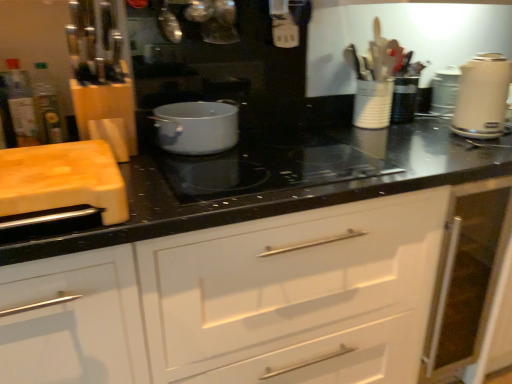
Locate an element on the screen. The image size is (512, 384). vacant space underneath white glossy electric kettle at right, the 1th kitchen appliance positioned from the right (from a real-world perspective) is located at coordinates (487, 128).